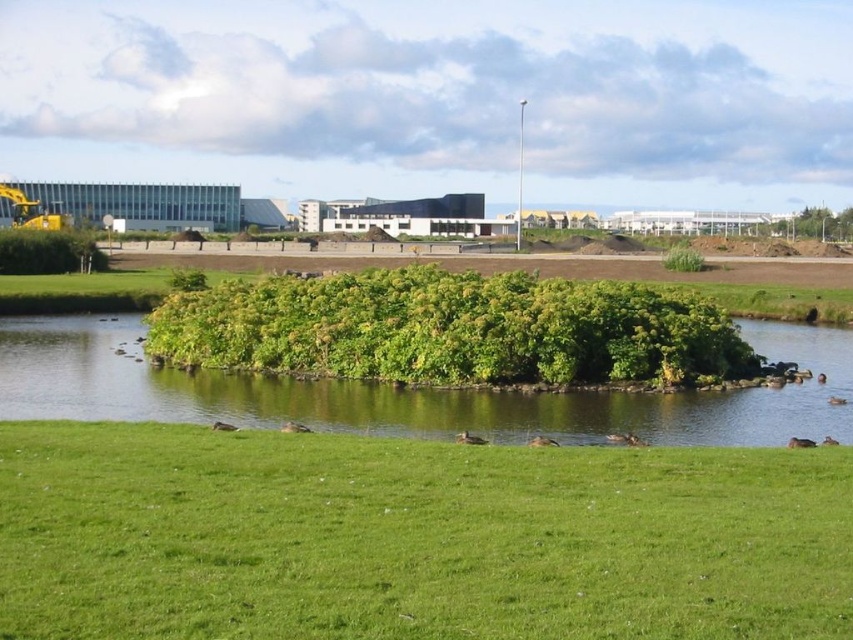
You are standing on the grassy area and want to walk towards the green leafy island at center. Which direction should you walk to avoid the green leafy bush at center?

Since the green leafy bush at center is to the right of the green leafy island at center, you should walk to the left to avoid the green leafy bush at center and reach the green leafy island at center.

You are standing at the edge of the water and want to place a 3.5 meter long wooden bridge between the green leafy bush at center and the green leafy island at center. Will the bridge be long enough to connect them?

The distance between the green leafy bush at center and the green leafy island at center is 3.23 meters. Since the bridge is 3.5 meters long, it will be long enough to connect them with some extra length remaining.

Based on the photo, you are standing at the center of the image and want to place a small statue exactly at the coordinates given for the green leafy bush at center. Can you confirm the exact location where the statue should be placed?

The green leafy bush at center is located at point (451, 330), so the statue should be placed at those coordinates.